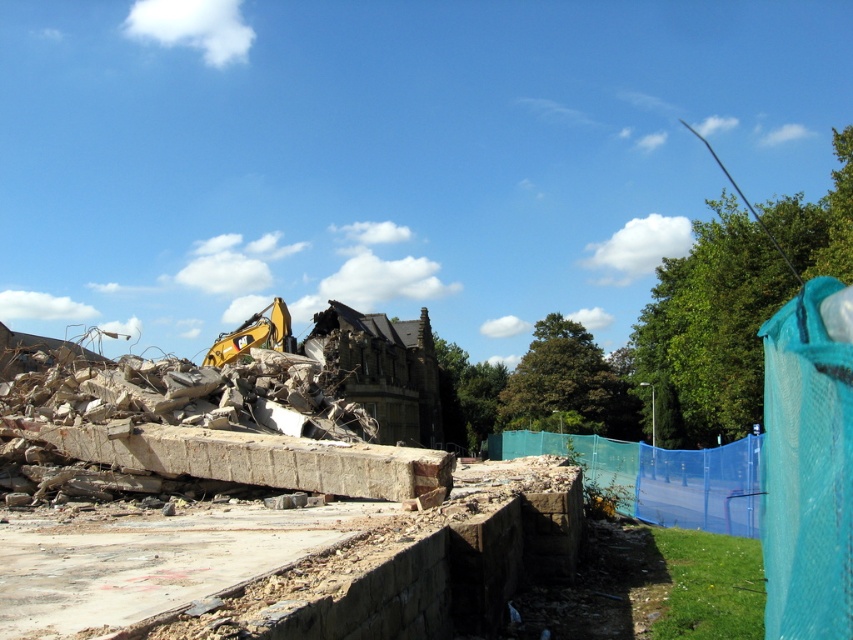
Question: Which point appears closest to the camera in this image?

Choices:
 (A) pyautogui.click(x=624, y=458)
 (B) pyautogui.click(x=260, y=342)

Answer: (A)

Question: Does blue mesh fence at right have a smaller size compared to yellow metallic excavator at upper left?

Choices:
 (A) no
 (B) yes

Answer: (A)

Question: Which object appears closest to the camera in this image?

Choices:
 (A) yellow metallic excavator at upper left
 (B) blue mesh fence at right

Answer: (B)

Question: Does blue mesh fence at right appear on the left side of yellow metallic excavator at upper left?

Choices:
 (A) no
 (B) yes

Answer: (A)

Question: Is blue mesh fence at right further to the viewer compared to yellow metallic excavator at upper left?

Choices:
 (A) no
 (B) yes

Answer: (A)